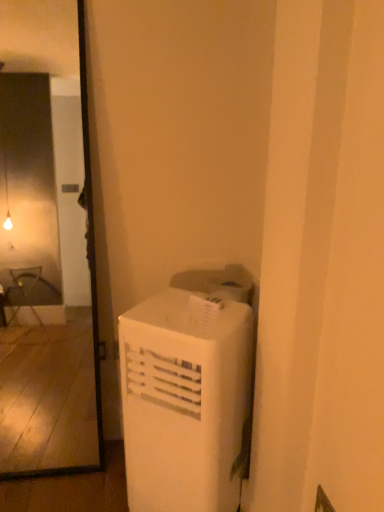
The height and width of the screenshot is (512, 384). What do you see at coordinates (186, 401) in the screenshot?
I see `white matte air conditioner at lower right` at bounding box center [186, 401].

Image resolution: width=384 pixels, height=512 pixels. I want to click on white matte air conditioner at lower right, so click(x=186, y=401).

This screenshot has height=512, width=384. I want to click on white matte air conditioner at lower right, so click(x=186, y=401).